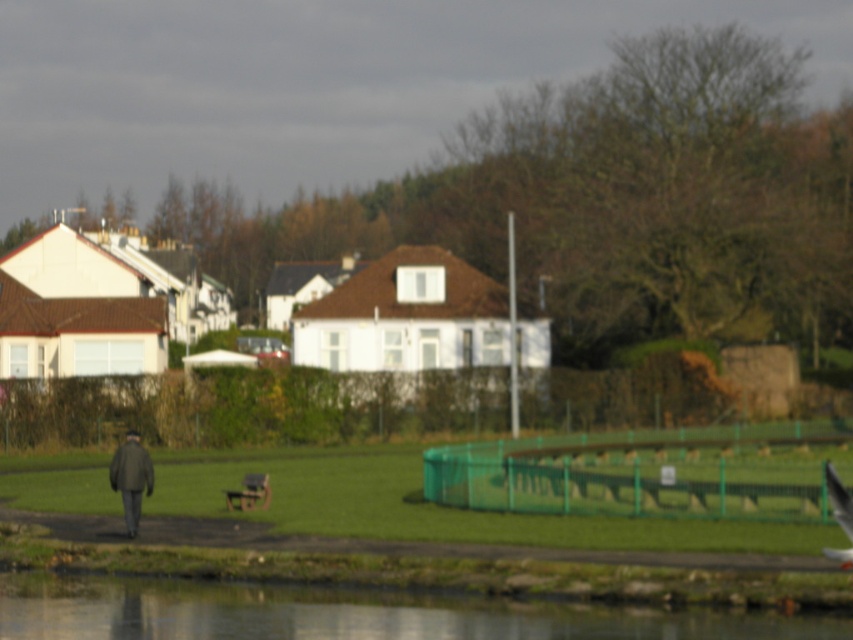
You are standing at the edge of the transparent water at lower center and want to reach the wooden park bench at center. Which direction should you walk to get there?

You should walk away from the viewer because the transparent water at lower center is closer to the viewer than the wooden park bench at center, so moving towards the bench requires walking away from your current position.

You are standing at the point marked by the coordinates point (351, 612). Based on the scene description, what is the terrain like at this location?

The terrain at point (351, 612) is transparent water at lower center, as indicated by the coordinates provided.